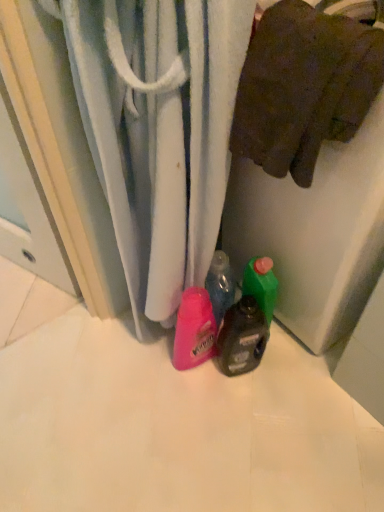
Question: From a real-world perspective, relative to brown cotton towel at upper right, is translucent plastic bottle at center vertically above or below?

Choices:
 (A) above
 (B) below

Answer: (B)

Question: In the image, is translucent plastic bottle at center on the left side or the right side of brown cotton towel at upper right?

Choices:
 (A) left
 (B) right

Answer: (A)

Question: Considering the real-world distances, which object is farthest from the white textured towel at center?

Choices:
 (A) brown cotton towel at upper right
 (B) translucent plastic bottle at center

Answer: (B)

Question: Based on their relative distances, which object is farther from the white textured towel at center?

Choices:
 (A) brown cotton towel at upper right
 (B) translucent plastic bottle at center

Answer: (B)